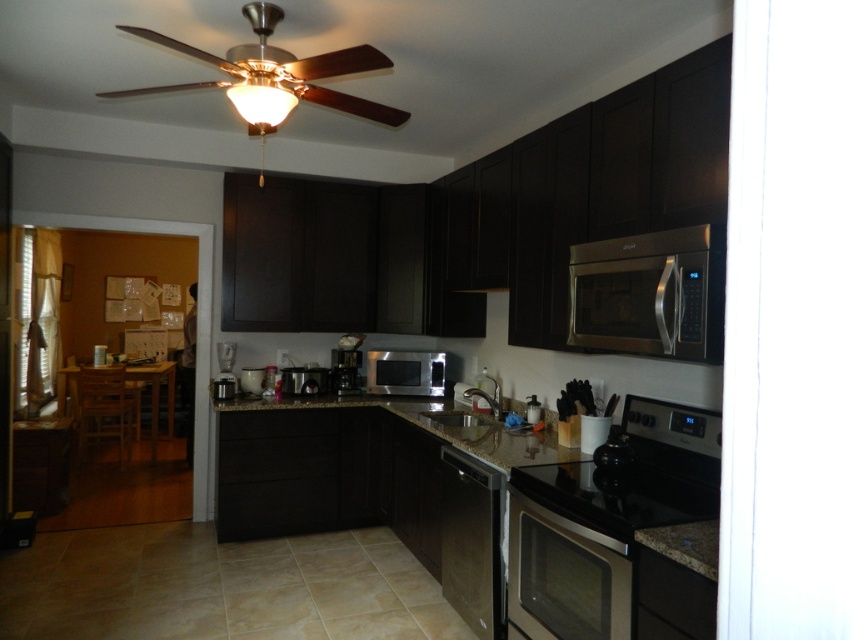
You are a delivery person who just brought a new microwave to this kitchen. The new microwave is 20 inches wide. The current microwave is the satin black microwave at center. You want to place the new microwave in the same spot as the current one. Is there enough space on the granite countertop at center for the new microwave?

The granite countertop at center is 19.84 inches from the satin black microwave at center. Since the new microwave is 20 inches wide, it would not fit in the available space as the countertop space is slightly smaller than the microwave.

You are a kitchen designer planning to install a new appliance. You have a space that can only accommodate items up to the height of the satin black coffee maker at center. Can the stainless steel microwave at upper right fit in this space?

The stainless steel microwave at upper right is taller than the satin black coffee maker at center, so it cannot fit in the space allocated for the coffee maker.

You are a chef preparing a meal in the kitchen. You need to place a hot dish on the granite countertop at center and then quickly access the satin black microwave at center to retrieve a side dish. Based on their positions, will you have to move far to reach the microwave from the countertop?

The granite countertop at center is located below the satin black microwave at center, so you will have to move upwards to reach the microwave from the countertop. Since the microwave is directly above the countertop, the distance moved will be minimal.